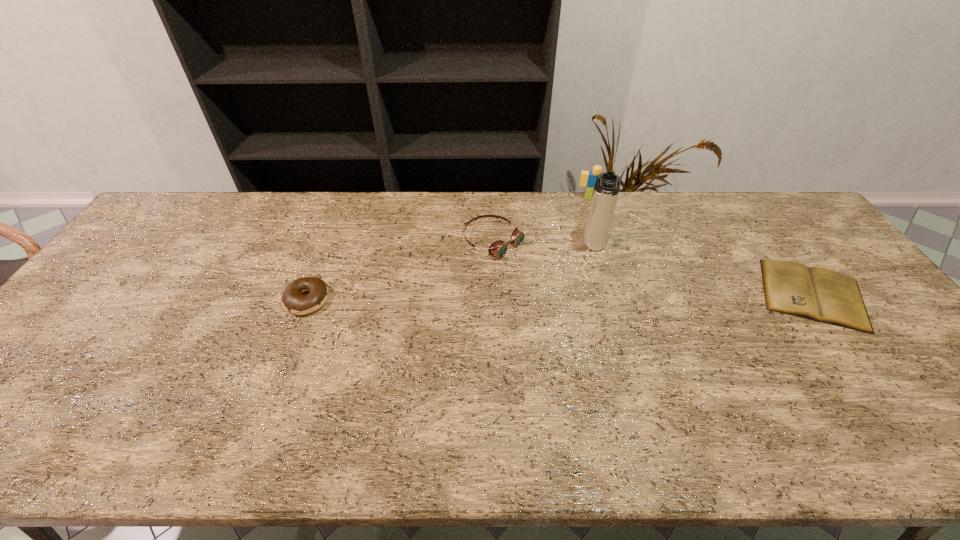
At what (x,y) coordinates should I click in order to perform the action: click on free spot on the desktop that is between the second shortest object and the book and is positioned on the handle side of the tallest object. Please return your answer as a coordinate pair (x, y). The height and width of the screenshot is (540, 960). Looking at the image, I should click on (588, 297).

The width and height of the screenshot is (960, 540). I want to click on vacant space on the desktop that is between the leftmost object and the shortest object and is positioned through the lenses of the goggles, so click(x=582, y=297).

In order to click on vacant space on the desktop that is between the fourth tallest object and the shortest object and is positioned on the face of the Lego in this screenshot , I will do `click(587, 297)`.